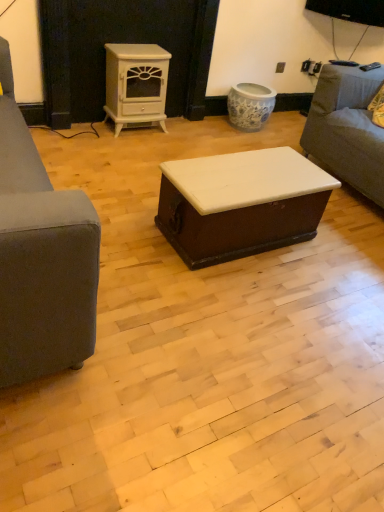
Question: Does point (314, 194) appear closer or farther from the camera than point (352, 137)?

Choices:
 (A) farther
 (B) closer

Answer: (B)

Question: Based on their sizes in the image, would you say white glossy trunk at center is bigger or smaller than gray fabric couch at right?

Choices:
 (A) small
 (B) big

Answer: (A)

Question: Estimate the real-world distances between objects in this image. Which object is closer to the white glossy wood stove at upper center?

Choices:
 (A) white glossy trunk at center
 (B) gray fabric couch at right

Answer: (B)

Question: Considering the real-world distances, which object is farthest from the white glossy trunk at center?

Choices:
 (A) white glossy wood stove at upper center
 (B) gray fabric couch at right

Answer: (A)